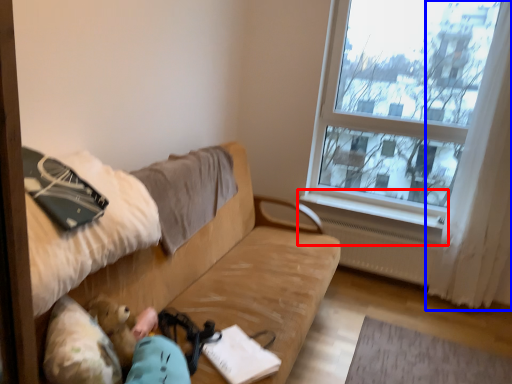
Question: Which of the following is the closest to the observer, window sill (highlighted by a red box) or curtain (highlighted by a blue box)?

Choices:
 (A) window sill
 (B) curtain

Answer: (B)